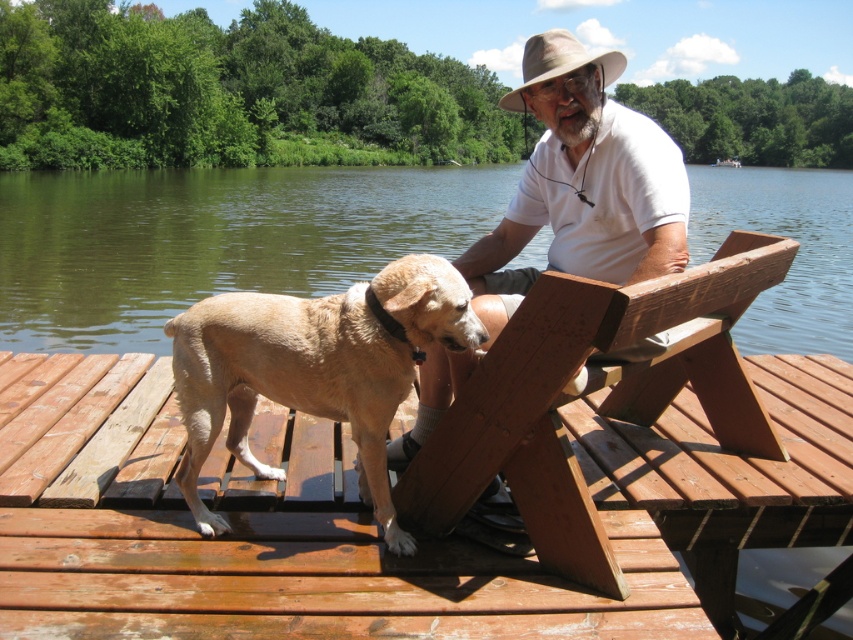
Can you confirm if wooden picnic table at center is thinner than light brown fur at center?

In fact, wooden picnic table at center might be wider than light brown fur at center.

Does wooden picnic table at center come in front of light brown fur at center?

Yes, wooden picnic table at center is in front of light brown fur at center.

Where is `wooden picnic table at center`? wooden picnic table at center is located at coordinates (451, 484).

Does point (230, 230) lie behind point (379, 410)?

Yes, it is behind point (379, 410).

Between brown water at center and light brown fur at center, which one is positioned higher?

Positioned higher is brown water at center.

Where is `brown water at center`? brown water at center is located at coordinates (212, 241).

Locate an element on the screen. brown water at center is located at coordinates point(212,241).

Is wooden picnic table at center shorter than white matte shirt at center?

Yes.

Can you confirm if wooden picnic table at center is positioned to the right of white matte shirt at center?

No, wooden picnic table at center is not to the right of white matte shirt at center.

Based on the photo, who is more forward, [161,522] or [488,243]?

Positioned in front is point [161,522].

Find the location of a particular element. This screenshot has width=853, height=640. wooden picnic table at center is located at coordinates (451, 484).